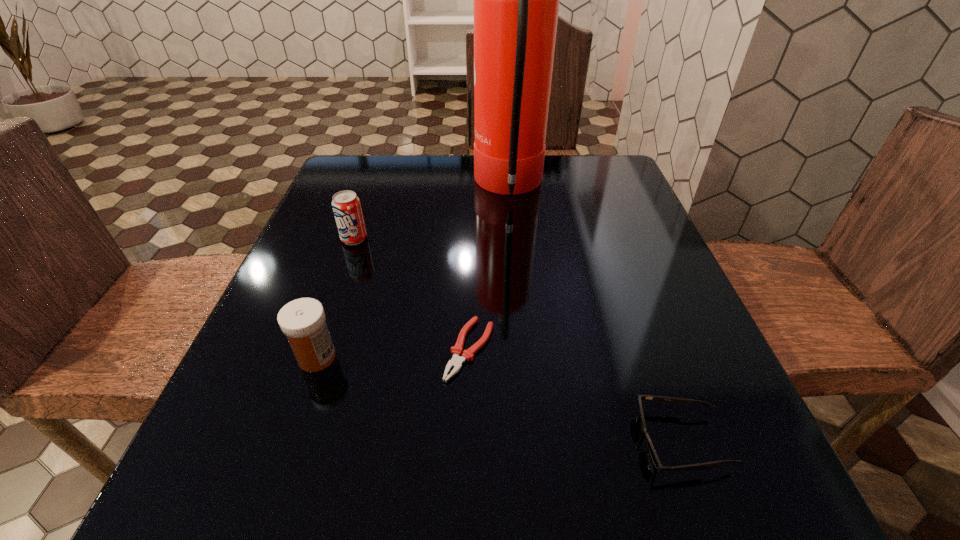
Locate an element on the screen. This screenshot has width=960, height=540. free point between the rightmost object and the medicine is located at coordinates (499, 399).

Find the location of a particular element. Image resolution: width=960 pixels, height=540 pixels. vacant region between the fire extinguisher and the pliers is located at coordinates (490, 268).

Identify the location of vacant point located between the medicine and the tallest object. This screenshot has width=960, height=540. (413, 272).

Image resolution: width=960 pixels, height=540 pixels. Find the location of `vacant region between the medicine and the shortest object`. vacant region between the medicine and the shortest object is located at coordinates (394, 353).

Locate an element on the screen. free area in between the sunglasses and the medicine is located at coordinates pos(499,399).

This screenshot has height=540, width=960. What are the coordinates of `free space that is in between the medicine and the fire extinguisher` in the screenshot? It's located at (413, 272).

Where is `free spot between the medicine and the fourth nearest object`? free spot between the medicine and the fourth nearest object is located at coordinates (336, 298).

Locate an element on the screen. Image resolution: width=960 pixels, height=540 pixels. empty space between the shortest object and the medicine is located at coordinates (394, 353).

The width and height of the screenshot is (960, 540). I want to click on blank region between the shortest object and the fire extinguisher, so click(490, 268).

This screenshot has width=960, height=540. In order to click on object that is the fourth closest one to the fire extinguisher in this screenshot , I will do `click(678, 401)`.